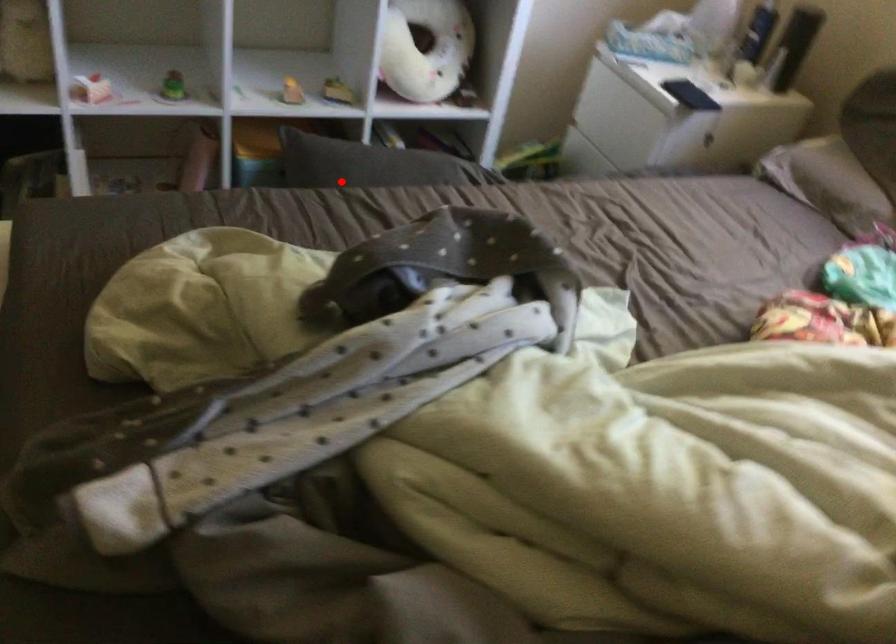
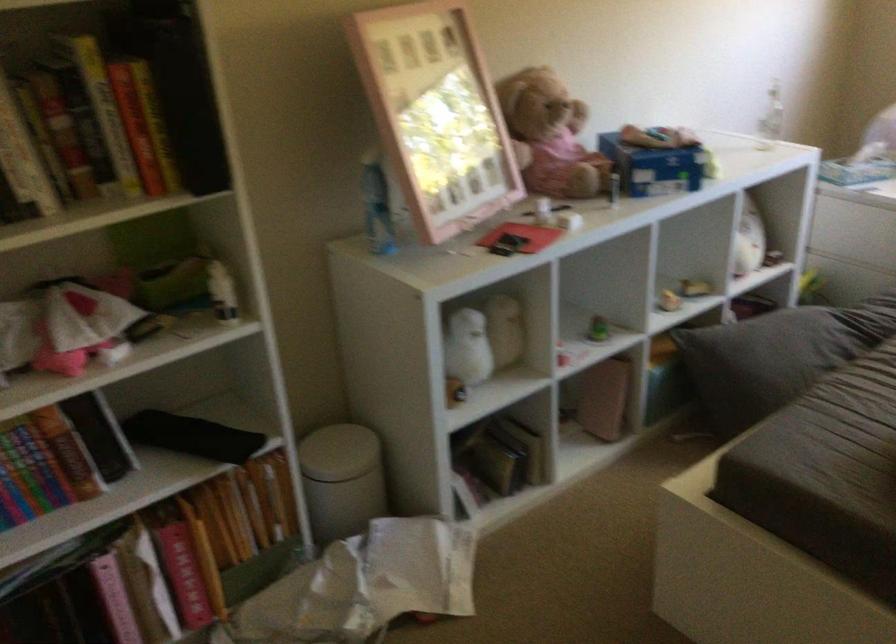
In the second image, find the point that corresponds to the highlighted location in the first image.

(776, 357)